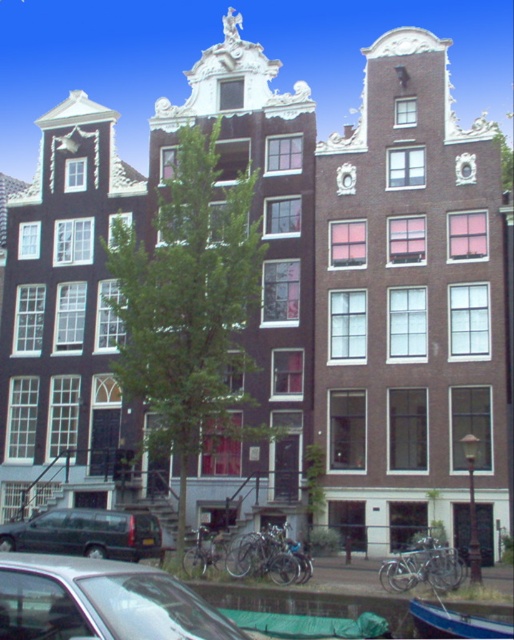
Question: Which is farther from the matte black van at lower left?

Choices:
 (A) blue painted wood boat at lower right
 (B) silver metallic bicycle at center
 (C) shiny silver car at lower left
 (D) silver metallic bicycle at lower center

Answer: (A)

Question: Which of the following is the closest to the observer?

Choices:
 (A) shiny silver car at lower left
 (B) silver metallic bicycle at lower center

Answer: (A)

Question: Estimate the real-world distances between objects in this image. Which object is closer to the shiny silver car at lower left?

Choices:
 (A) blue painted wood boat at lower right
 (B) silver metallic bicycle at center
 (C) matte black van at lower left
 (D) silver metallic bicycle at lower center

Answer: (C)

Question: Can you confirm if shiny silver car at lower left is wider than matte black van at lower left?

Choices:
 (A) yes
 (B) no

Answer: (A)

Question: Does silver metallic bicycle at lower center have a larger size compared to blue painted wood boat at lower right?

Choices:
 (A) no
 (B) yes

Answer: (B)

Question: Is shiny silver car at lower left to the right of silver metallic bicycle at lower center from the viewer's perspective?

Choices:
 (A) no
 (B) yes

Answer: (A)